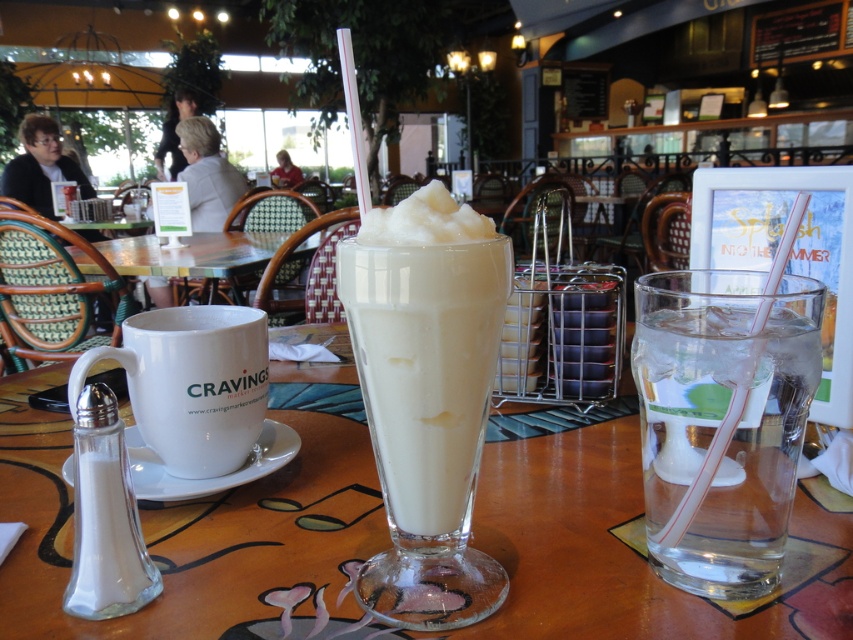
Question: Among these points, which one is nearest to the camera?

Choices:
 (A) [276, 600]
 (B) [183, 253]
 (C) [502, 253]

Answer: (C)

Question: Does transparent glass at center appear on the left side of clear glass water at right?

Choices:
 (A) yes
 (B) no

Answer: (A)

Question: Is clear glass water at right bigger than white frothy milkshake at center?

Choices:
 (A) yes
 (B) no

Answer: (A)

Question: Which point is farther to the camera?

Choices:
 (A) (349, 632)
 (B) (677, 333)

Answer: (B)

Question: Considering the real-world distances, which object is closest to the white frothy milkshake at center?

Choices:
 (A) transparent glass at center
 (B) clear glass water at right
 (C) white glossy table at center

Answer: (B)

Question: In this image, where is clear glass water at right located relative to white glossy table at center?

Choices:
 (A) below
 (B) above

Answer: (A)